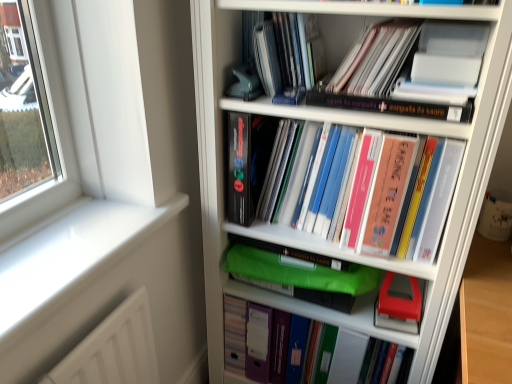
Locate an element on the screen. This screenshot has height=384, width=512. matte pink paper at upper center, the fourth book ordered from the bottom is located at coordinates (375, 59).

The height and width of the screenshot is (384, 512). I want to click on matte black book at upper center, placed as the fifth book when sorted from bottom to top, so click(x=284, y=53).

The height and width of the screenshot is (384, 512). Describe the element at coordinates (391, 106) in the screenshot. I see `hardcover book at upper center, positioned as the 3th book in bottom-to-top order` at that location.

What do you see at coordinates (399, 303) in the screenshot?
I see `red matte stapler at center` at bounding box center [399, 303].

Locate an element on the screen. white glossy window sill at left is located at coordinates (70, 255).

Describe the element at coordinates (70, 255) in the screenshot. I see `white glossy window sill at left` at that location.

This screenshot has width=512, height=384. In order to click on matte pink paper at upper center, the fourth book ordered from the bottom in this screenshot , I will do `click(375, 59)`.

From the image's perspective, does matte pink paper at upper center, the 2th book when ordered from top to bottom, appear higher than hardcover book at center, marked as the 2th book in a bottom-to-top arrangement?

Yes, from the image's perspective, matte pink paper at upper center, the 2th book when ordered from top to bottom, is above hardcover book at center, marked as the 2th book in a bottom-to-top arrangement.

From a real-world perspective, is matte pink paper at upper center, the fourth book ordered from the bottom, physically above hardcover book at center, the fourth book viewed from the top?

Yes, from a real-world perspective, matte pink paper at upper center, the fourth book ordered from the bottom, is over hardcover book at center, the fourth book viewed from the top

Does matte pink paper at upper center, the fourth book ordered from the bottom, have a smaller size compared to hardcover book at center, marked as the 2th book in a bottom-to-top arrangement?

Indeed, matte pink paper at upper center, the fourth book ordered from the bottom, has a smaller size compared to hardcover book at center, marked as the 2th book in a bottom-to-top arrangement.

Is matte pink paper at upper center, the fourth book ordered from the bottom, next to hardcover book at center, marked as the 2th book in a bottom-to-top arrangement, and touching it?

They are not placed beside each other.

From the image's perspective, is hardcover book at center, the fourth book viewed from the top, on hardcover book at upper center, positioned as the 3th book in bottom-to-top order?

No.

Does hardcover book at center, marked as the 2th book in a bottom-to-top arrangement, have a greater width compared to hardcover book at upper center, placed as the third book when sorted from top to bottom?

Incorrect, the width of hardcover book at center, marked as the 2th book in a bottom-to-top arrangement, does not surpass that of hardcover book at upper center, placed as the third book when sorted from top to bottom.

Looking at this image, would you say hardcover book at center, the fourth book viewed from the top, is outside hardcover book at upper center, positioned as the 3th book in bottom-to-top order?

Yes.

Which is behind, point (358, 226) or point (419, 113)?

The point (358, 226) is farther from the camera.

Does white glossy window sill at left have a larger size compared to matte pink paper at upper center, the 2th book when ordered from top to bottom?

Correct, white glossy window sill at left is larger in size than matte pink paper at upper center, the 2th book when ordered from top to bottom.

Between white glossy window sill at left and matte pink paper at upper center, the 2th book when ordered from top to bottom, which one has more height?

Standing taller between the two is matte pink paper at upper center, the 2th book when ordered from top to bottom.

Is white glossy window sill at left touching matte pink paper at upper center, the fourth book ordered from the bottom?

They are not placed beside each other.

Is hardcover book at upper center, placed as the third book when sorted from top to bottom, further to camera compared to white glossy window sill at left?

Yes, hardcover book at upper center, placed as the third book when sorted from top to bottom, is further from the viewer.

Does hardcover book at upper center, positioned as the 3th book in bottom-to-top order, have a smaller size compared to white glossy window sill at left?

Indeed, hardcover book at upper center, positioned as the 3th book in bottom-to-top order, has a smaller size compared to white glossy window sill at left.

Is white glossy window sill at left turned away from hardcover book at center, the fourth book viewed from the top?

No, white glossy window sill at left is not facing away from hardcover book at center, the fourth book viewed from the top.

Can you tell me how much white glossy window sill at left and hardcover book at center, the fourth book viewed from the top, differ in facing direction?

There is a 89.6-degree angle between the facing directions of white glossy window sill at left and hardcover book at center, the fourth book viewed from the top.

Considering the positions of objects white glossy window sill at left and hardcover book at center, the fourth book viewed from the top, in the image provided, who is behind, white glossy window sill at left or hardcover book at center, the fourth book viewed from the top,?

hardcover book at center, the fourth book viewed from the top, is further from the camera.

From their relative heights in the image, would you say white glossy window sill at left is taller or shorter than hardcover book at center, marked as the 2th book in a bottom-to-top arrangement?

white glossy window sill at left is shorter than hardcover book at center, marked as the 2th book in a bottom-to-top arrangement.

How far apart are white plastic bookcase at center and matte black book at upper center, which is the 1th book from top to bottom?

white plastic bookcase at center is 9.43 inches away from matte black book at upper center, which is the 1th book from top to bottom.

Would you consider white plastic bookcase at center to be distant from matte black book at upper center, placed as the fifth book when sorted from bottom to top?

No, white plastic bookcase at center is in close proximity to matte black book at upper center, placed as the fifth book when sorted from bottom to top.

Can you tell me how much white plastic bookcase at center and matte black book at upper center, which is the 1th book from top to bottom, differ in facing direction?

They differ by 2.06 degrees in their facing directions.

Is point (453, 280) positioned behind point (250, 29)?

No, (453, 280) is closer to viewer.

Is hardcover book at center, the fourth book viewed from the top, at the right side of matte black book at upper center, which is the 1th book from top to bottom?

Yes, hardcover book at center, the fourth book viewed from the top, is to the right of matte black book at upper center, which is the 1th book from top to bottom.

From a real-world perspective, is hardcover book at center, the fourth book viewed from the top, located beneath matte black book at upper center, which is the 1th book from top to bottom?

Yes.

Can you confirm if hardcover book at center, the fourth book viewed from the top, is shorter than matte black book at upper center, which is the 1th book from top to bottom?

In fact, hardcover book at center, the fourth book viewed from the top, may be taller than matte black book at upper center, which is the 1th book from top to bottom.

Image resolution: width=512 pixels, height=384 pixels. I want to click on the 2nd book below the matte pink paper at upper center, the fourth book ordered from the bottom (from the image's perspective), so click(378, 192).

Where is `the 1st book in front of the hardcover book at center, marked as the 2th book in a bottom-to-top arrangement`? Image resolution: width=512 pixels, height=384 pixels. the 1st book in front of the hardcover book at center, marked as the 2th book in a bottom-to-top arrangement is located at coordinates (391, 106).

When comparing their distances from hardcover book at upper center, placed as the third book when sorted from top to bottom, does matte black book at upper center, placed as the fifth book when sorted from bottom to top, or green plastic folder at center, the 5th book viewed from the top, seem closer?

matte black book at upper center, placed as the fifth book when sorted from bottom to top, lies closer to hardcover book at upper center, placed as the third book when sorted from top to bottom, than the other object.

Estimate the real-world distances between objects in this image. Which object is further from white plastic bookcase at center, hardcover book at upper center, placed as the third book when sorted from top to bottom, or hardcover book at center, marked as the 2th book in a bottom-to-top arrangement?

hardcover book at upper center, placed as the third book when sorted from top to bottom, lies further to white plastic bookcase at center than the other object.

When comparing their distances from hardcover book at upper center, placed as the third book when sorted from top to bottom, does hardcover book at center, the fourth book viewed from the top, or white plastic bookcase at center seem further?

white plastic bookcase at center lies further to hardcover book at upper center, placed as the third book when sorted from top to bottom, than the other object.

Considering their positions, is hardcover book at upper center, positioned as the 3th book in bottom-to-top order, positioned closer to matte black book at upper center, placed as the fifth book when sorted from bottom to top, than hardcover book at center, the fourth book viewed from the top?

The object closer to matte black book at upper center, placed as the fifth book when sorted from bottom to top, is hardcover book at upper center, positioned as the 3th book in bottom-to-top order.

Looking at the image, which one is located further to matte black book at upper center, which is the 1th book from top to bottom, hardcover book at center, marked as the 2th book in a bottom-to-top arrangement, or hardcover book at upper center, placed as the third book when sorted from top to bottom?

hardcover book at center, marked as the 2th book in a bottom-to-top arrangement, lies further to matte black book at upper center, which is the 1th book from top to bottom, than the other object.

Estimate the real-world distances between objects in this image. Which object is closer to white plastic bookcase at center, green plastic folder at center, arranged as the 1th book when ordered from the bottom, or white glossy window sill at left?

green plastic folder at center, arranged as the 1th book when ordered from the bottom, lies closer to white plastic bookcase at center than the other object.

Estimate the real-world distances between objects in this image. Which object is further from matte pink paper at upper center, the 2th book when ordered from top to bottom, white plastic bookcase at center or red matte stapler at center?

Among the two, red matte stapler at center is located further to matte pink paper at upper center, the 2th book when ordered from top to bottom.

Which object lies further to the anchor point red matte stapler at center, white glossy window sill at left or hardcover book at center, the fourth book viewed from the top?

white glossy window sill at left is further to red matte stapler at center.

This screenshot has height=384, width=512. Identify the location of paperback book that lies between hardcover book at center, marked as the 2th book in a bottom-to-top arrangement, and green plastic folder at center, the 5th book viewed from the top, from top to bottom. (399, 303).

Locate an element on the screen. The image size is (512, 384). bookcase located between white glossy window sill at left and hardcover book at upper center, placed as the third book when sorted from top to bottom, in the left-right direction is located at coordinates (345, 160).

Identify the location of bookcase between white glossy window sill at left and hardcover book at center, the fourth book viewed from the top, in the horizontal direction. The image size is (512, 384). (345, 160).

Where is `window sill between matte black book at upper center, placed as the fifth book when sorted from bottom to top, and green plastic folder at center, arranged as the 1th book when ordered from the bottom, in the up-down direction`? This screenshot has width=512, height=384. window sill between matte black book at upper center, placed as the fifth book when sorted from bottom to top, and green plastic folder at center, arranged as the 1th book when ordered from the bottom, in the up-down direction is located at coordinates (70, 255).